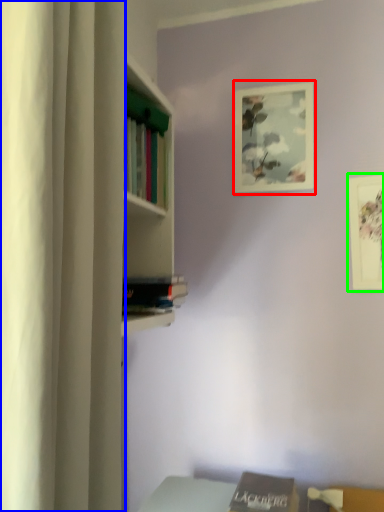
Question: Which is farther away from picture frame (highlighted by a red box)? curtain (highlighted by a blue box) or picture frame (highlighted by a green box)?

Choices:
 (A) curtain
 (B) picture frame

Answer: (A)